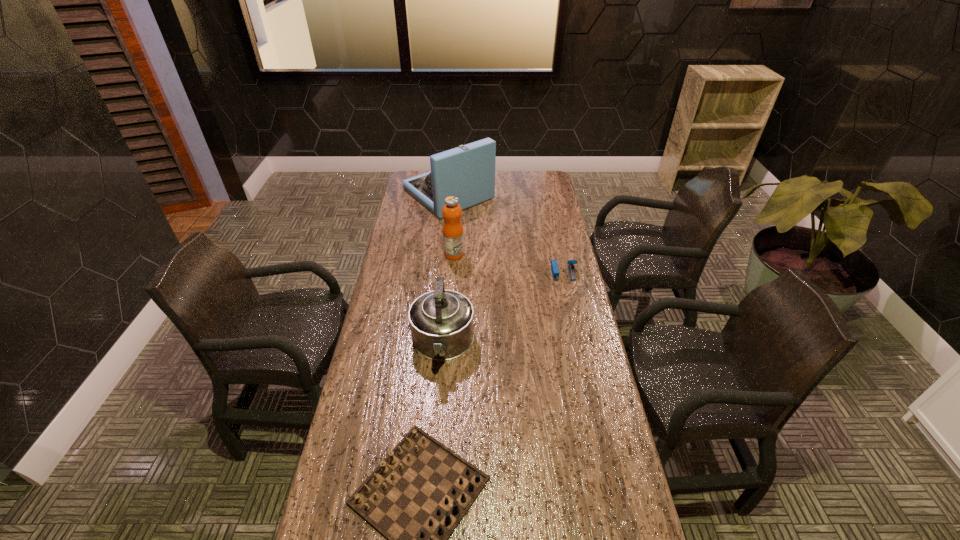
Locate an element on the screen. This screenshot has height=540, width=960. phonograph record positioned at the left edge is located at coordinates (467, 172).

Find the location of a particular element. This screenshot has height=540, width=960. kettle present at the left edge is located at coordinates (442, 322).

Identify the location of object present at the right edge. (554, 266).

Image resolution: width=960 pixels, height=540 pixels. In order to click on object at the far left corner in this screenshot , I will do `click(467, 172)`.

This screenshot has width=960, height=540. I want to click on vacant space at the far edge, so click(x=519, y=191).

Find the location of `vacant region at the right edge of the desktop`. vacant region at the right edge of the desktop is located at coordinates (627, 463).

Where is `vacant area at the far right corner of the desktop`? The image size is (960, 540). vacant area at the far right corner of the desktop is located at coordinates (550, 181).

Where is `free space between the phonograph record and the rightmost object`? This screenshot has width=960, height=540. free space between the phonograph record and the rightmost object is located at coordinates (506, 233).

This screenshot has height=540, width=960. I want to click on vacant region between the kettle and the farthest object, so point(445,269).

Where is `vacant area that lies between the third nearest object and the fruit juice`? vacant area that lies between the third nearest object and the fruit juice is located at coordinates (509, 264).